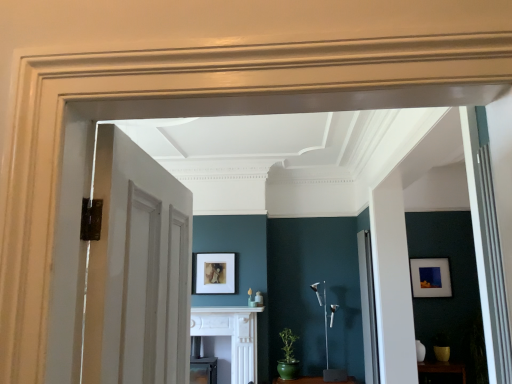
Question: From a real-world perspective, does white wood door at left, arranged as the second door when viewed from the back, stand above brown wooden shelf at lower right?

Choices:
 (A) yes
 (B) no

Answer: (A)

Question: Does white wood door at left, the 1th door positioned from the left, have a greater width compared to brown wooden shelf at lower right?

Choices:
 (A) yes
 (B) no

Answer: (B)

Question: Considering the relative sizes of white wood door at left, positioned as the 1th door in top-to-bottom order, and brown wooden shelf at lower right in the image provided, is white wood door at left, positioned as the 1th door in top-to-bottom order, shorter than brown wooden shelf at lower right?

Choices:
 (A) yes
 (B) no

Answer: (B)

Question: Is white wood door at left, the second door positioned from the bottom, taller than brown wooden shelf at lower right?

Choices:
 (A) yes
 (B) no

Answer: (A)

Question: Is white wood door at left, the 1th door positioned from the left, outside of brown wooden shelf at lower right?

Choices:
 (A) no
 (B) yes

Answer: (B)

Question: From the image's perspective, is white glossy door at right, the 2th door in the front-to-back sequence, positioned above or below white glossy fireplace at center?

Choices:
 (A) below
 (B) above

Answer: (B)

Question: Considering the positions of white glossy door at right, the second door viewed from the left, and white glossy fireplace at center in the image, is white glossy door at right, the second door viewed from the left, taller or shorter than white glossy fireplace at center?

Choices:
 (A) tall
 (B) short

Answer: (A)

Question: Is white glossy door at right, the 1th door in the right-to-left sequence, situated inside white glossy fireplace at center or outside?

Choices:
 (A) inside
 (B) outside

Answer: (B)

Question: In the image, is white glossy door at right, which is the 2th door from top to bottom, on the left side or the right side of white glossy fireplace at center?

Choices:
 (A) left
 (B) right

Answer: (B)

Question: Is point (236, 256) closer or farther from the camera than point (364, 236)?

Choices:
 (A) farther
 (B) closer

Answer: (A)

Question: Considering the relative positions of matte gold picture frame at center, which is the second picture frame from back to front, and white glossy door at right, the 2th door in the front-to-back sequence, in the image provided, is matte gold picture frame at center, which is the second picture frame from back to front, to the left or to the right of white glossy door at right, the 2th door in the front-to-back sequence,?

Choices:
 (A) right
 (B) left

Answer: (B)

Question: In terms of size, does matte gold picture frame at center, the 2th picture frame viewed from the right, appear bigger or smaller than white glossy door at right, which is the 2th door from top to bottom?

Choices:
 (A) small
 (B) big

Answer: (A)

Question: In terms of width, does matte gold picture frame at center, the 2th picture frame viewed from the right, look wider or thinner when compared to white glossy door at right, which is counted as the 1th door, starting from the back?

Choices:
 (A) wide
 (B) thin

Answer: (B)

Question: Do you think brown wooden shelf at lower right is within matte gold picture frame at center, the first picture frame when ordered from front to back, or outside of it?

Choices:
 (A) inside
 (B) outside

Answer: (B)

Question: Based on their sizes in the image, would you say brown wooden shelf at lower right is bigger or smaller than matte gold picture frame at center, the 2th picture frame viewed from the right?

Choices:
 (A) big
 (B) small

Answer: (A)